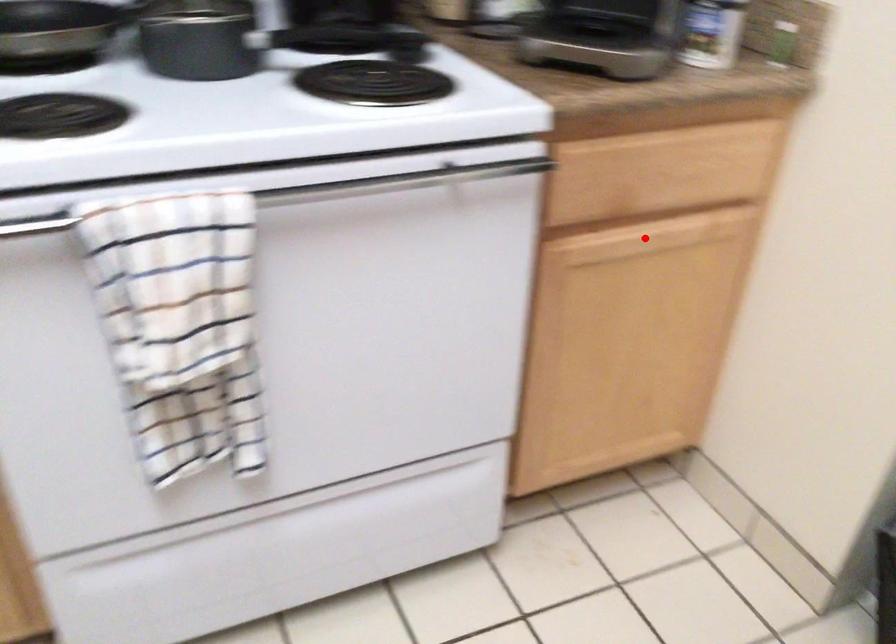
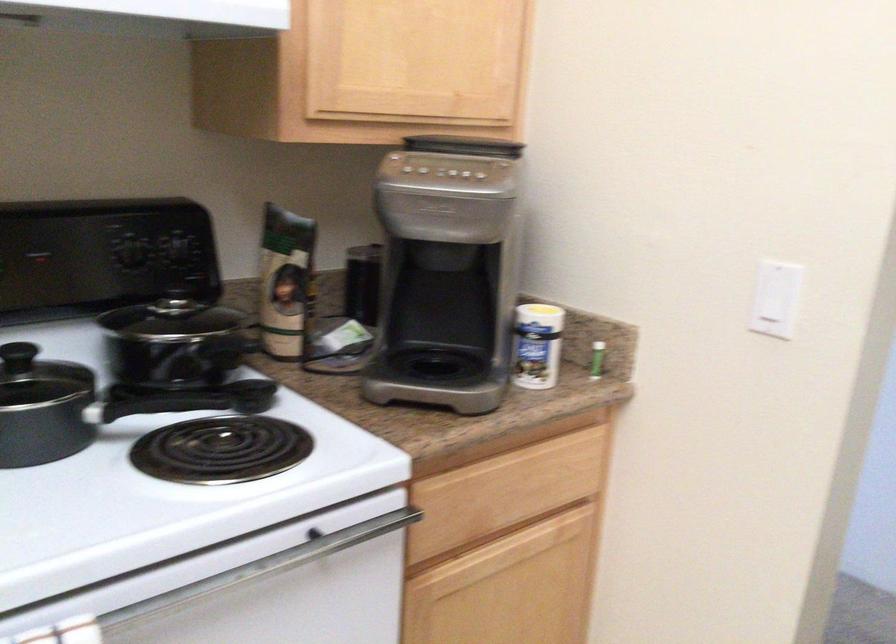
Locate, in the second image, the point that corresponds to the highlighted location in the first image.

(504, 554)